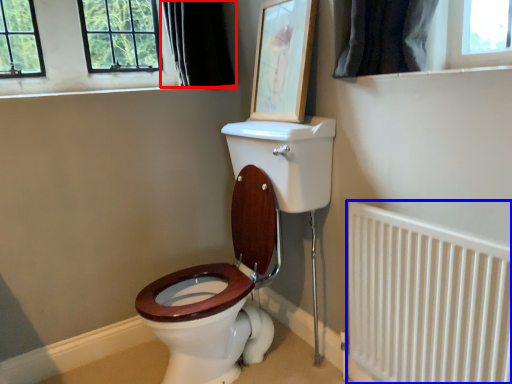
Question: Which of the following is the closest to the observer, curtain (highlighted by a red box) or radiator (highlighted by a blue box)?

Choices:
 (A) curtain
 (B) radiator

Answer: (B)